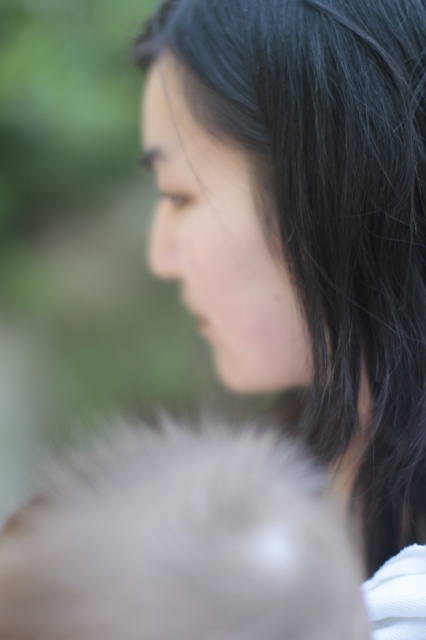
You are a photographer who wants to capture a portrait of the person in the image. You need to adjust your camera settings to focus on the black silky hair at center and the fuzzy white fur at lower left. Which object should you focus on first to ensure both are in focus?

The black silky hair at center is above the fuzzy white fur at lower left, so you should focus on the black silky hair at center first to ensure both are in focus.

Based on the scene description, which object is positioned higher in the image between the black silky hair at center and the fuzzy white fur at lower left?

The black silky hair at center is positioned higher in the image than the fuzzy white fur at lower left because it is described as much taller.